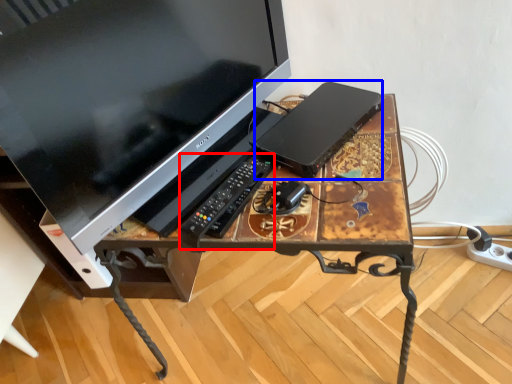
Question: Which object is closer to the camera taking this photo, control (highlighted by a red box) or computer (highlighted by a blue box)?

Choices:
 (A) control
 (B) computer

Answer: (A)